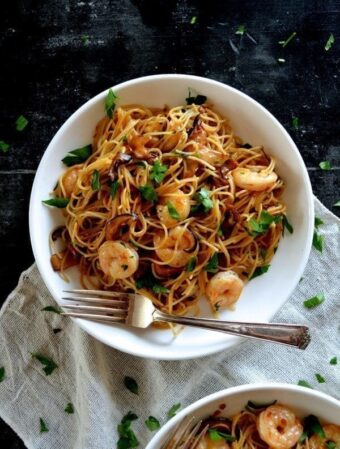
Identify the location of bowl. (269, 289), (291, 403).